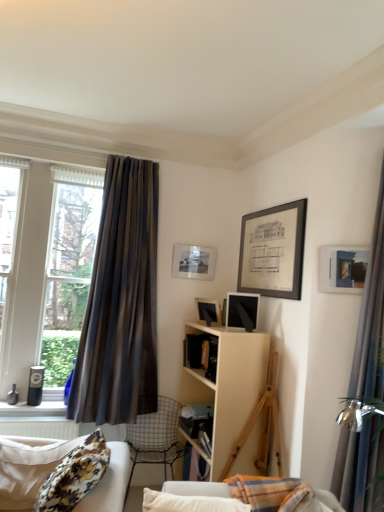
Question: Is metallic wire chair at lower center oriented towards matte glass picture frame at upper center, positioned as the 3th picture frame in front-to-back order?

Choices:
 (A) yes
 (B) no

Answer: (B)

Question: Is metallic wire chair at lower center not near matte glass picture frame at upper center, positioned as the 3th picture frame in front-to-back order?

Choices:
 (A) yes
 (B) no

Answer: (A)

Question: Is metallic wire chair at lower center to the left of matte glass picture frame at upper center, the 1th picture frame from the left, from the viewer's perspective?

Choices:
 (A) no
 (B) yes

Answer: (B)

Question: Does metallic wire chair at lower center have a greater height compared to matte glass picture frame at upper center, placed as the third picture frame when sorted from right to left?

Choices:
 (A) yes
 (B) no

Answer: (A)

Question: Is metallic wire chair at lower center thinner than matte glass picture frame at upper center, positioned as the 3th picture frame in front-to-back order?

Choices:
 (A) yes
 (B) no

Answer: (B)

Question: Is brown striped curtain at left, which is the second curtain in front-to-back order, in front of or behind clear glass window at left in the image?

Choices:
 (A) behind
 (B) front

Answer: (B)

Question: Does point (117, 393) appear closer or farther from the camera than point (57, 372)?

Choices:
 (A) farther
 (B) closer

Answer: (B)

Question: Do you think brown striped curtain at left, the 1th curtain in the left-to-right sequence, is within clear glass window at left, or outside of it?

Choices:
 (A) inside
 (B) outside

Answer: (B)

Question: Considering the positions of brown striped curtain at left, marked as the 1th curtain in a back-to-front arrangement, and clear glass window at left in the image, is brown striped curtain at left, marked as the 1th curtain in a back-to-front arrangement, taller or shorter than clear glass window at left?

Choices:
 (A) tall
 (B) short

Answer: (A)

Question: In terms of height, does floral fabric studio couch at lower left look taller or shorter compared to matte black speaker at left?

Choices:
 (A) short
 (B) tall

Answer: (B)

Question: From a real-world perspective, relative to matte black speaker at left, is floral fabric studio couch at lower left vertically above or below?

Choices:
 (A) above
 (B) below

Answer: (B)

Question: Considering the positions of floral fabric studio couch at lower left and matte black speaker at left in the image, is floral fabric studio couch at lower left wider or thinner than matte black speaker at left?

Choices:
 (A) wide
 (B) thin

Answer: (A)

Question: Is floral fabric studio couch at lower left inside the boundaries of matte black speaker at left, or outside?

Choices:
 (A) inside
 (B) outside

Answer: (B)

Question: Relative to matte glass picture frame at upper center, placed as the third picture frame when sorted from right to left, is matte black speaker at left in front or behind?

Choices:
 (A) front
 (B) behind

Answer: (A)

Question: Is matte black speaker at left taller or shorter than matte glass picture frame at upper center, the 1th picture frame from the left?

Choices:
 (A) tall
 (B) short

Answer: (B)